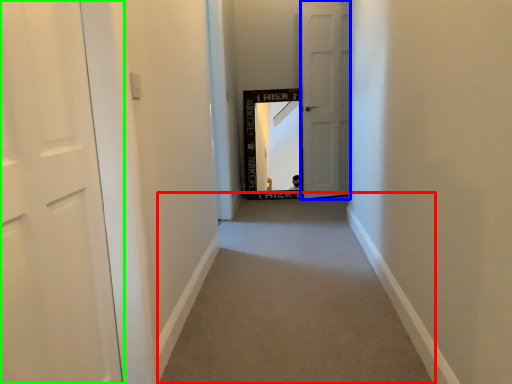
Question: Estimate the real-world distances between objects in this image. Which object is farther from alley (highlighted by a red box), door (highlighted by a blue box) or door (highlighted by a green box)?

Choices:
 (A) door
 (B) door

Answer: (A)